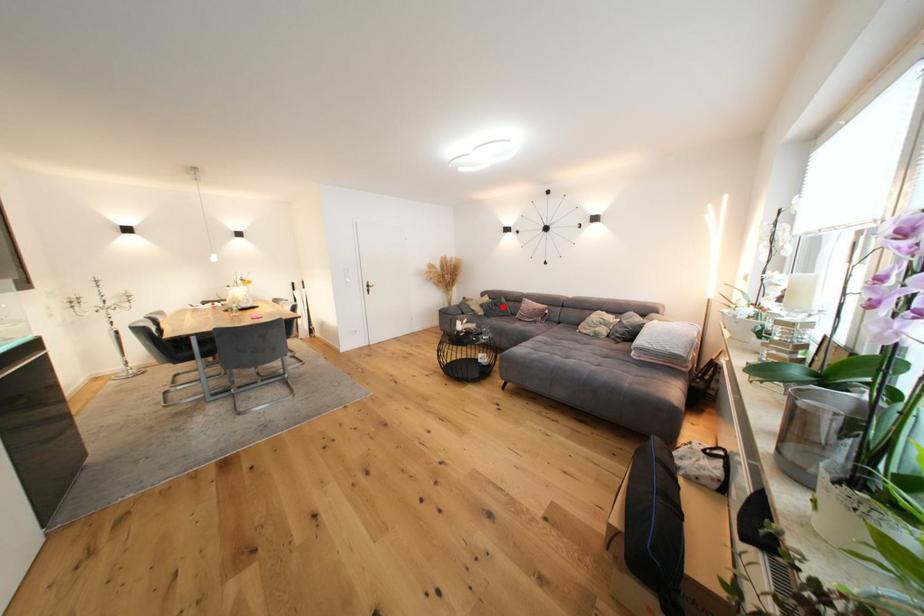
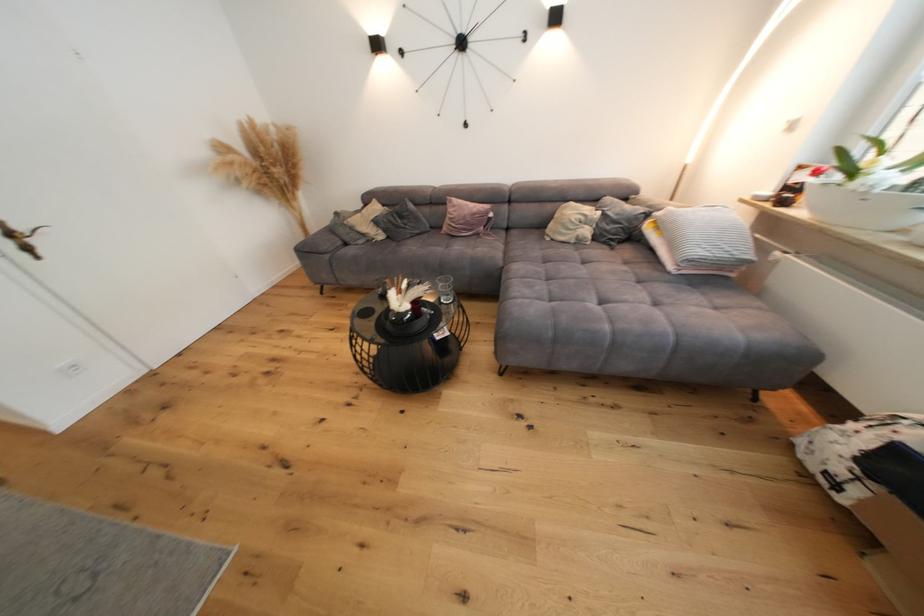
Where in the second image is the point corresponding to the highlighted location from the first image?

(408, 219)